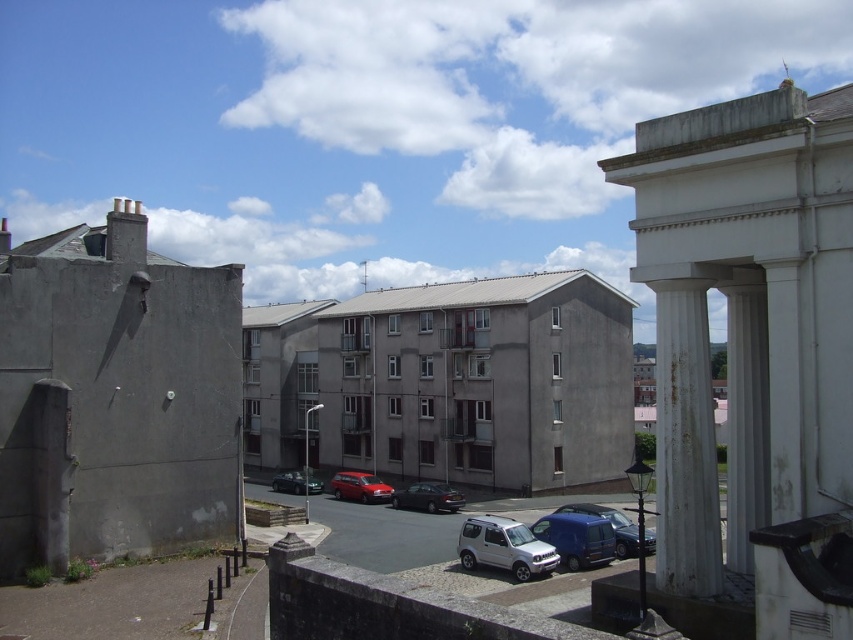
Which is in front, point (566, 534) or point (299, 484)?

Point (566, 534) is more forward.

Can you confirm if matte blue van at lower center is positioned above metallic silver sedan at center?

Correct, matte blue van at lower center is located above metallic silver sedan at center.

Is point (575, 560) farther from camera compared to point (302, 477)?

No, (575, 560) is in front of (302, 477).

Locate an element on the screen. This screenshot has height=640, width=853. matte blue van at lower center is located at coordinates (577, 538).

Who is taller, silver metallic suv at center or metallic silver sedan at center?

Standing taller between the two is silver metallic suv at center.

Between silver metallic suv at center and metallic silver sedan at center, which one appears on the left side from the viewer's perspective?

metallic silver sedan at center

From the picture: Who is more distant from viewer, (x=471, y=548) or (x=302, y=484)?

The point (x=302, y=484) is behind.

You are a GUI agent. You are given a task and a screenshot of the screen. Output one action in this format:
    pyautogui.click(x=<x>, y=<y>)
    Task: Click on the silver metallic suv at center
    This screenshot has width=853, height=640.
    Given the screenshot: What is the action you would take?
    (x=503, y=547)

Can you confirm if blue metallic van at center is positioned to the left of shiny black sedan at center?

Incorrect, blue metallic van at center is not on the left side of shiny black sedan at center.

Who is shorter, blue metallic van at center or shiny black sedan at center?

With less height is shiny black sedan at center.

Does point (647, 540) come closer to viewer compared to point (426, 481)?

Yes, it is in front of point (426, 481).

At what (x,y) coordinates should I click in order to perform the action: click on blue metallic van at center. Please return your answer as a coordinate pair (x, y). The image size is (853, 640). Looking at the image, I should click on click(611, 525).